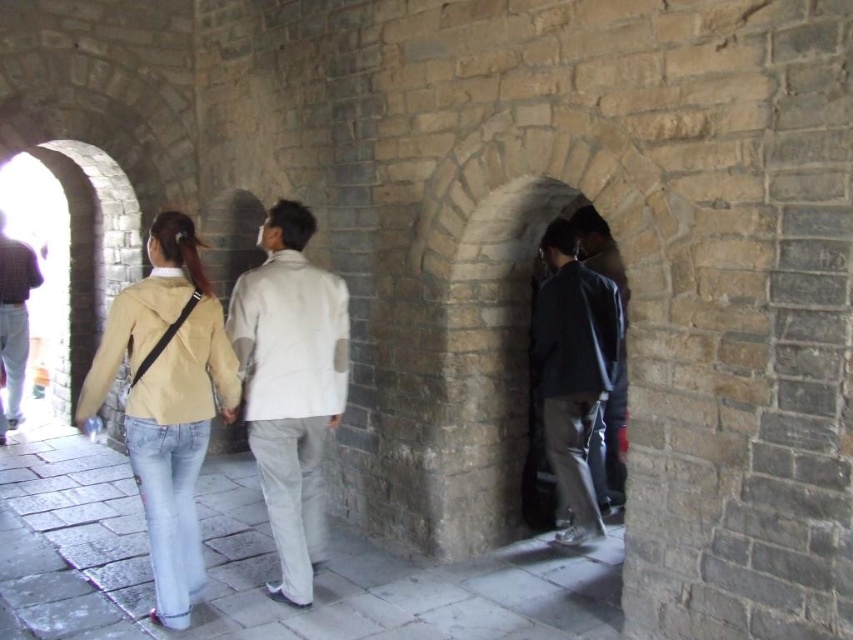
Question: Is white matte jacket at center thinner than dark brown leather jacket at left?

Choices:
 (A) yes
 (B) no

Answer: (B)

Question: Is dark gray fabric jacket at center thinner than dark brown leather jacket at left?

Choices:
 (A) yes
 (B) no

Answer: (B)

Question: Observing the image, what is the correct spatial positioning of white matte jacket at center in reference to dark brown leather jacket at left?

Choices:
 (A) left
 (B) right

Answer: (B)

Question: Which object is farther from the camera taking this photo?

Choices:
 (A) white matte jacket at center
 (B) light beige denim jacket at center

Answer: (A)

Question: Based on their relative distances, which object is farther from the dark gray fabric jacket at center?

Choices:
 (A) white matte jacket at center
 (B) light beige denim jacket at center

Answer: (B)

Question: Which object is farther from the camera taking this photo?

Choices:
 (A) dark brown leather jacket at left
 (B) white matte jacket at center

Answer: (A)